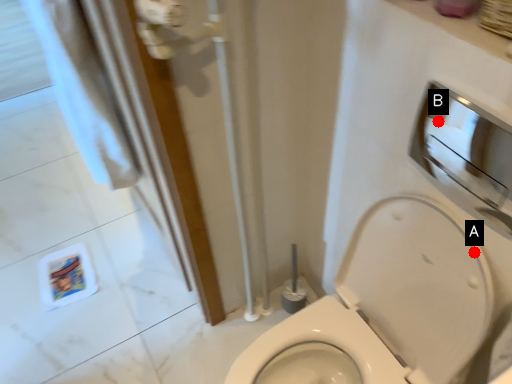
Question: Two points are circled on the image, labeled by A and B beside each circle. Which of the following is the farthest from the observer?

Choices:
 (A) A is further
 (B) B is further

Answer: (A)